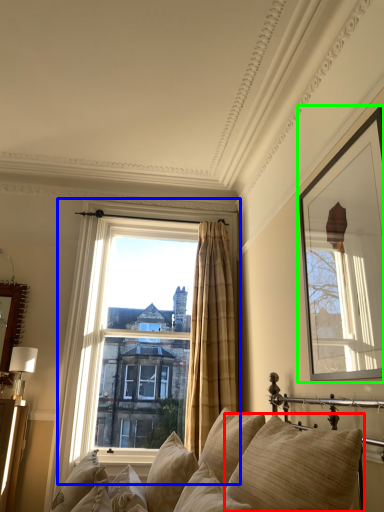
Question: Based on their relative distances, which object is farther from pillow (highlighted by a red box)? Choose from window (highlighted by a blue box) and picture frame (highlighted by a green box).

Choices:
 (A) window
 (B) picture frame

Answer: (A)